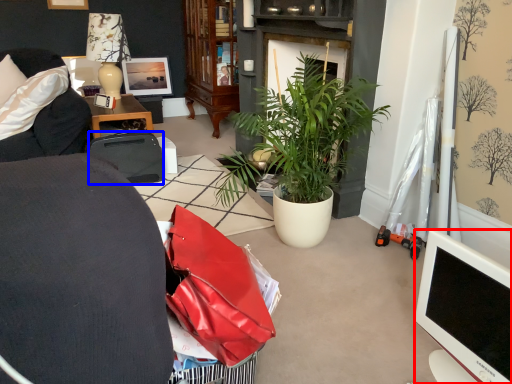
Question: Which of the following is the closest to the observer, television (highlighted by a red box) or luggage and bags (highlighted by a blue box)?

Choices:
 (A) television
 (B) luggage and bags

Answer: (A)